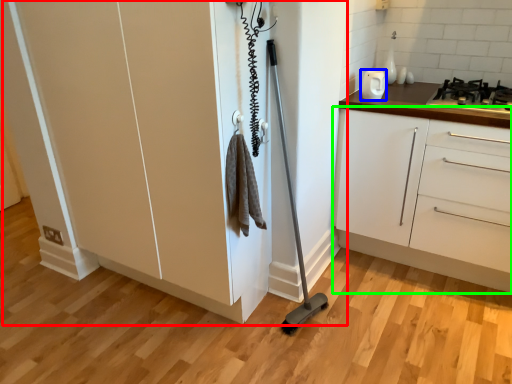
Question: Which is nearer to the cupboard (highlighted by a red box)? home appliance (highlighted by a blue box) or cabinetry (highlighted by a green box).

Choices:
 (A) home appliance
 (B) cabinetry

Answer: (B)